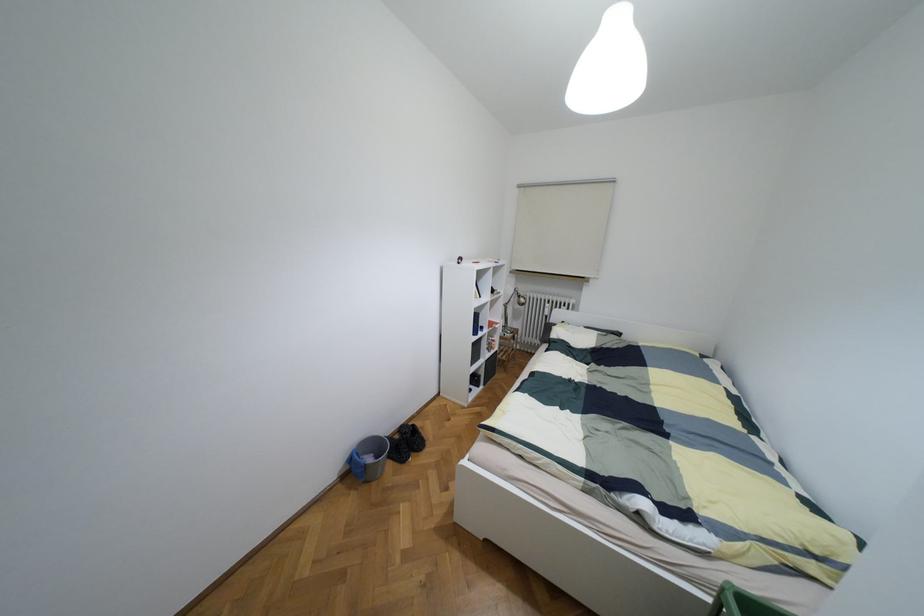
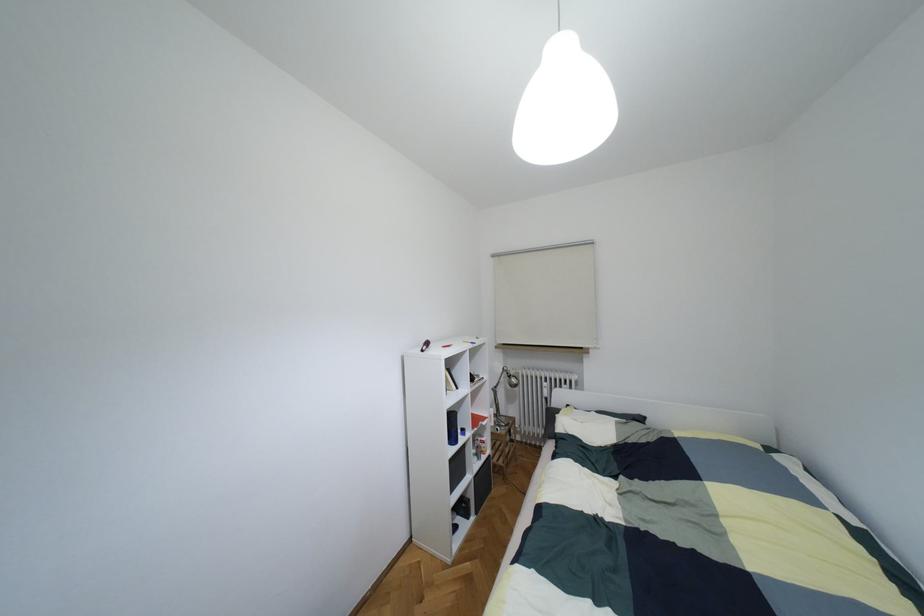
The images are taken continuously from a first-person perspective. In which direction are you moving?

The cameraman moved toward right, forward.